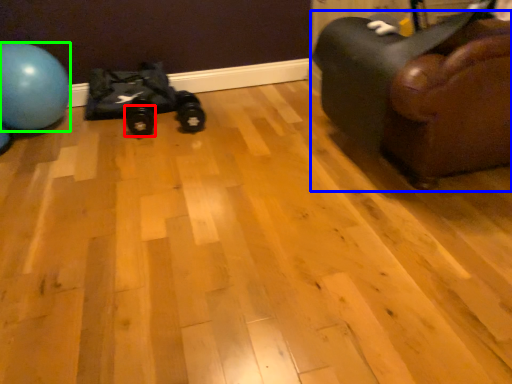
Question: Which object is the farthest from footwear (highlighted by a red box)? Choose among these: furniture (highlighted by a blue box) or ball (highlighted by a green box).

Choices:
 (A) furniture
 (B) ball

Answer: (A)